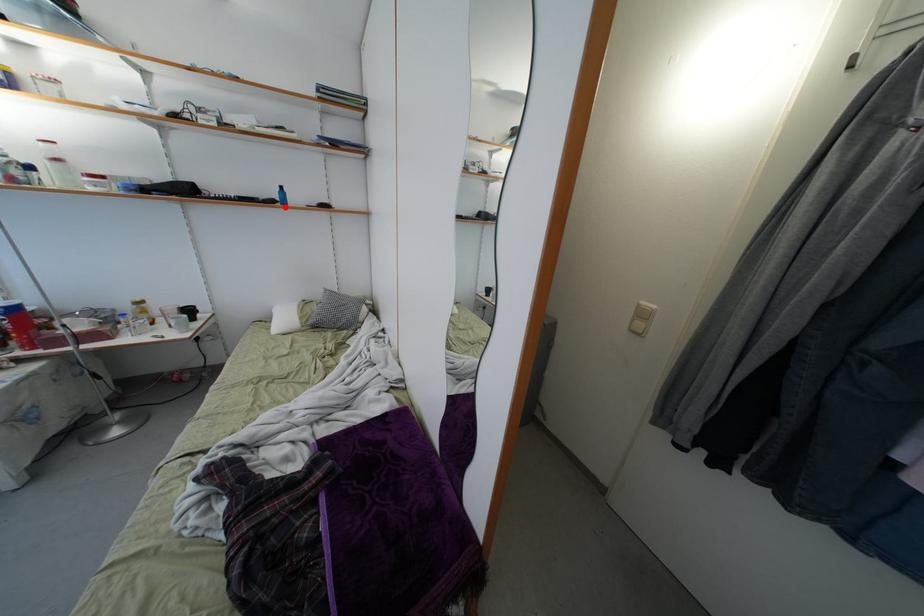
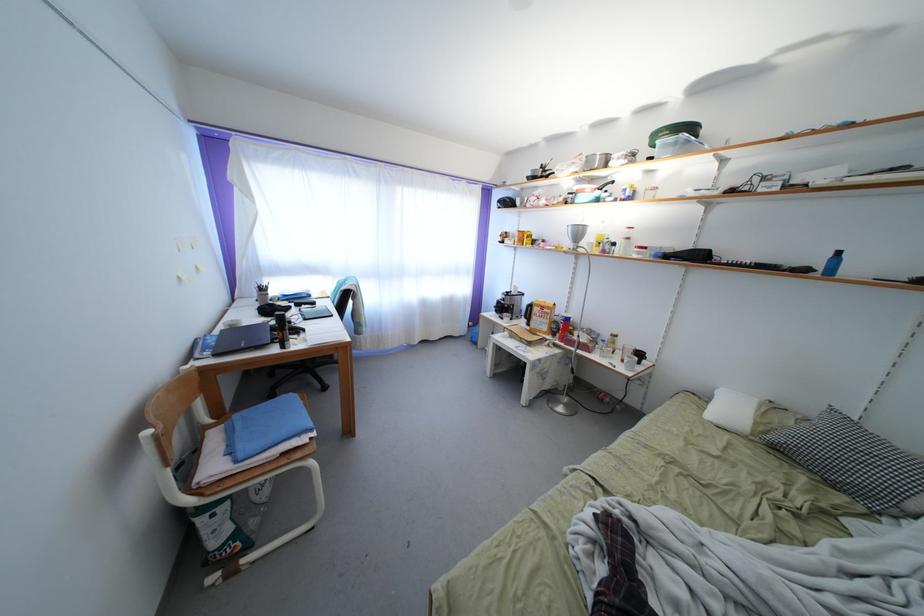
The point at the highlighted location is marked in the first image. Where is the corresponding point in the second image?

(823, 272)